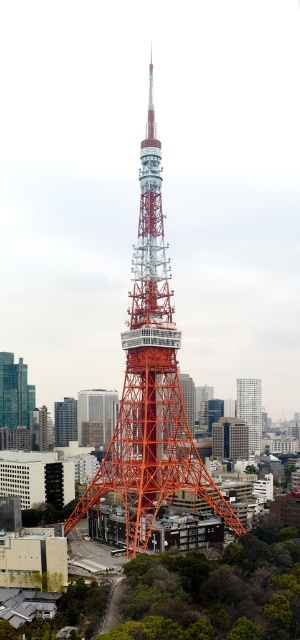
You are standing in front of the Tokyo Tower and want to take a photo of the orange metallic tower at center. If your camera can focus on objects up to 600 feet away, will it be able to capture the tower clearly?

The orange metallic tower at center is 619.54 feet away from camera. Since the camera can only focus up to 600 feet, it won not be able to capture the tower clearly.